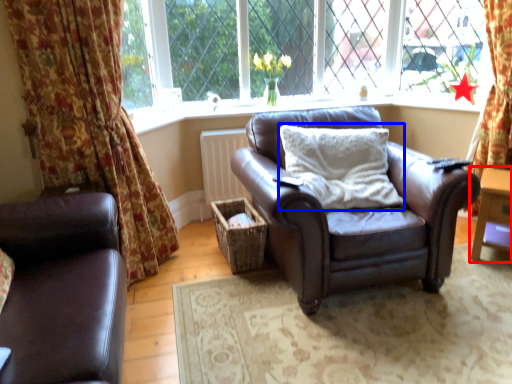
Question: Which object appears farthest to the camera in this image, table (highlighted by a red box) or pillow (highlighted by a blue box)?

Choices:
 (A) table
 (B) pillow

Answer: (A)